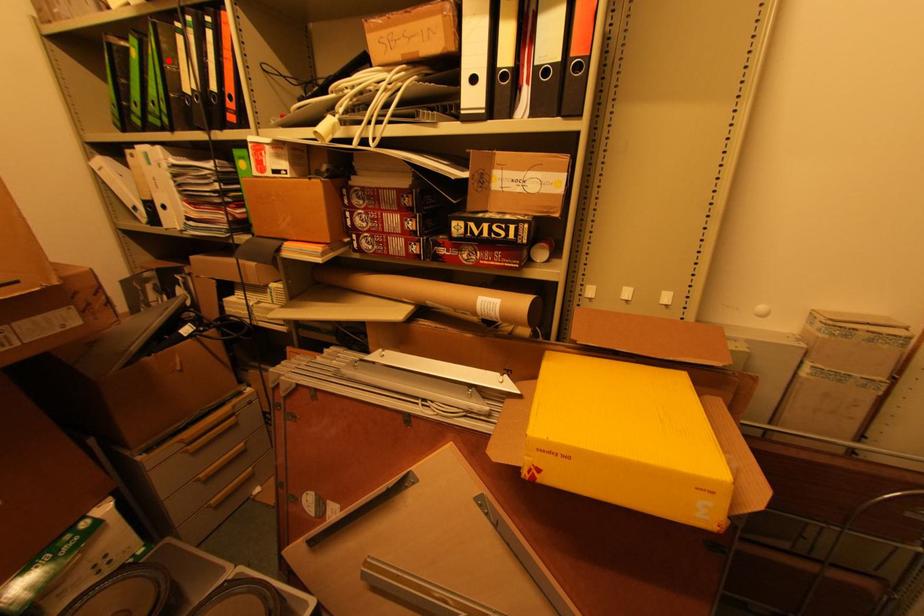
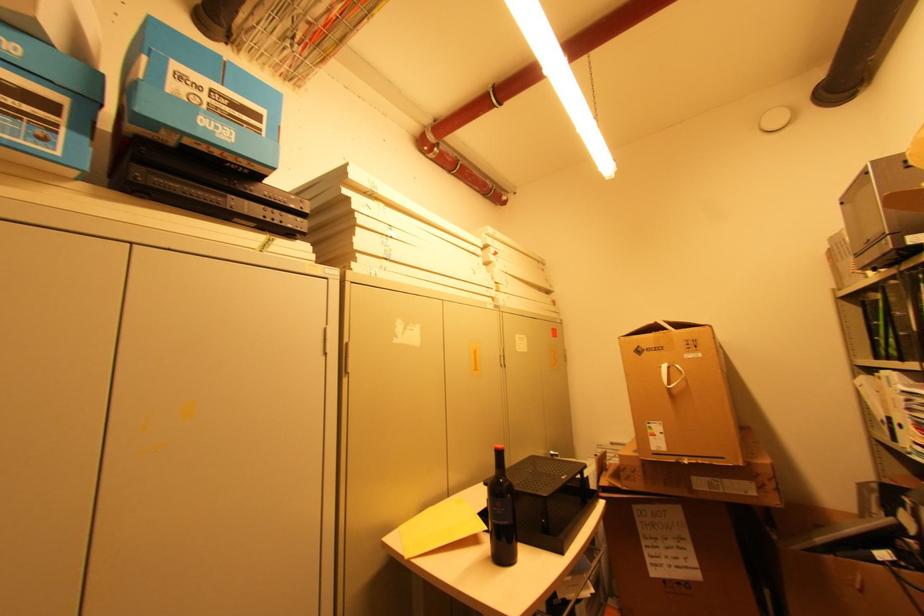
Question: I am providing you with two images of the same scene from different viewpoints. In image1, a red point is highlighted. Considering the same 3D point in image2, which of the following is correct?

Choices:
 (A) It is closer
 (B) It is farther

Answer: (A)